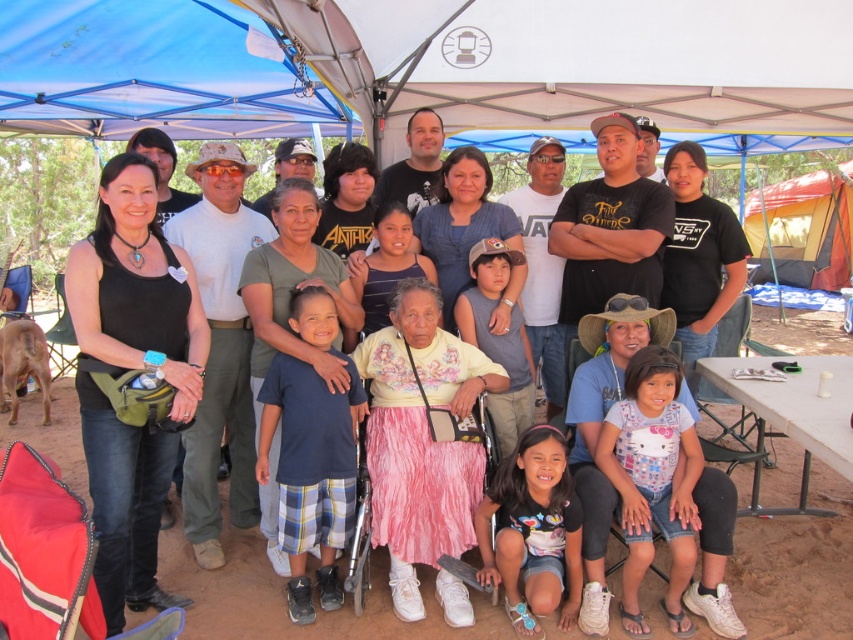
Between blue fabric canopy at upper left and white plastic picnic table at lower right, which one is positioned lower?

white plastic picnic table at lower right is below.

Between point (352, 112) and point (848, 381), which one is positioned behind?

The point (352, 112) is behind.

Measure the distance between blue fabric canopy at upper left and camera.

blue fabric canopy at upper left is 4.95 meters from camera.

You are a GUI agent. You are given a task and a screenshot of the screen. Output one action in this format:
    pyautogui.click(x=<x>, y=<y>)
    Task: Click on the blue fabric canopy at upper left
    
    Given the screenshot: What is the action you would take?
    pyautogui.click(x=155, y=72)

Is blue fabric canopy at upper left to the left of yellow canvas tent at upper right from the viewer's perspective?

Correct, you'll find blue fabric canopy at upper left to the left of yellow canvas tent at upper right.

Which is in front, point (68, 108) or point (784, 220)?

Positioned in front is point (68, 108).

Measure the distance between blue fabric canopy at upper left and camera.

A distance of 16.25 feet exists between blue fabric canopy at upper left and camera.

In order to click on blue fabric canopy at upper left in this screenshot , I will do `click(155, 72)`.

Does point (764, 440) lie in front of point (791, 186)?

Yes.

Image resolution: width=853 pixels, height=640 pixels. What are the coordinates of `white plastic picnic table at lower right` in the screenshot? It's located at (792, 416).